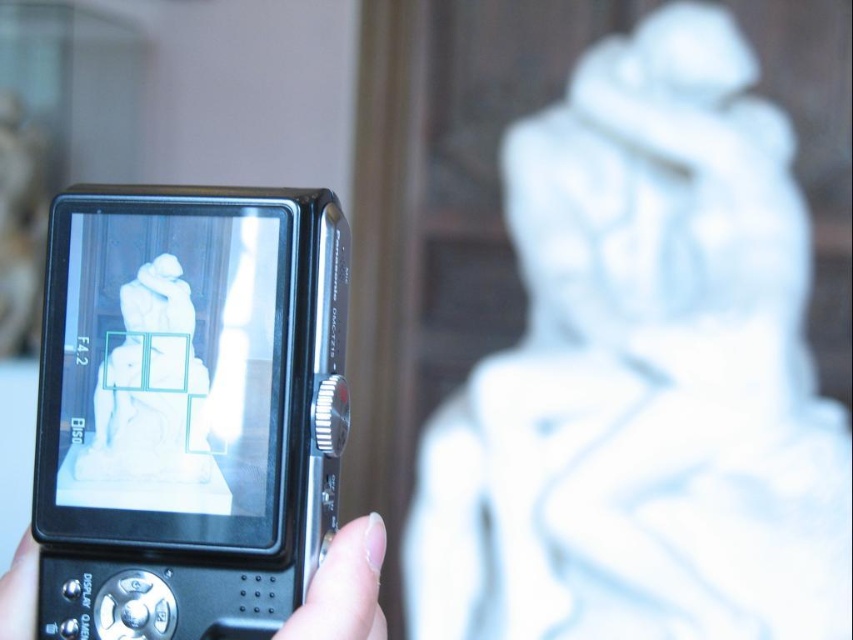
Can you confirm if black plastic camera at center is positioned below nail polish at lower center?

Incorrect, black plastic camera at center is not positioned below nail polish at lower center.

Based on the photo, can you confirm if black plastic camera at center is positioned to the right of nail polish at lower center?

Incorrect, black plastic camera at center is not on the right side of nail polish at lower center.

Locate an element on the screen. black plastic camera at center is located at coordinates (187, 408).

Can you confirm if white marble statue at center is shorter than nail polish at lower center?

No, white marble statue at center is not shorter than nail polish at lower center.

Does point (494, 627) come in front of point (363, 628)?

No.

The width and height of the screenshot is (853, 640). I want to click on white marble statue at center, so click(643, 376).

Where is `white marble statue at center`? Image resolution: width=853 pixels, height=640 pixels. white marble statue at center is located at coordinates (643, 376).

Can you confirm if white marble statue at center is positioned below black plastic camera at center?

No, white marble statue at center is not below black plastic camera at center.

Who is more forward, [698,547] or [143,216]?

Point [143,216] is in front.

Is point (697, 332) behind point (183, 397)?

Yes, it is.

Locate an element on the screen. The height and width of the screenshot is (640, 853). white marble statue at center is located at coordinates (643, 376).